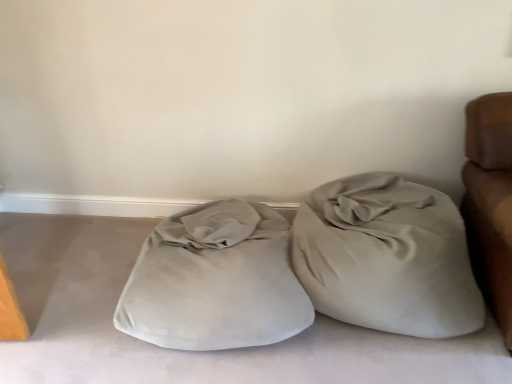
Question: Considering the relative positions of suede beige bean bag at right and suede-like beige pillow at center in the image provided, is suede beige bean bag at right to the left or to the right of suede-like beige pillow at center?

Choices:
 (A) right
 (B) left

Answer: (A)

Question: In terms of size, does suede beige bean bag at right appear bigger or smaller than suede-like beige pillow at center?

Choices:
 (A) big
 (B) small

Answer: (B)

Question: From a real-world perspective, relative to suede-like beige pillow at center, is suede beige bean bag at right vertically above or below?

Choices:
 (A) above
 (B) below

Answer: (A)

Question: Choose the correct answer: Is suede-like beige pillow at center inside suede beige bean bag at right or outside it?

Choices:
 (A) inside
 (B) outside

Answer: (B)

Question: In the image, is suede-like beige pillow at center on the left side or the right side of suede beige bean bag at right?

Choices:
 (A) left
 (B) right

Answer: (A)

Question: From a real-world perspective, is suede-like beige pillow at center above or below suede beige bean bag at right?

Choices:
 (A) below
 (B) above

Answer: (A)

Question: In terms of width, does suede-like beige pillow at center look wider or thinner when compared to suede beige bean bag at right?

Choices:
 (A) wide
 (B) thin

Answer: (A)